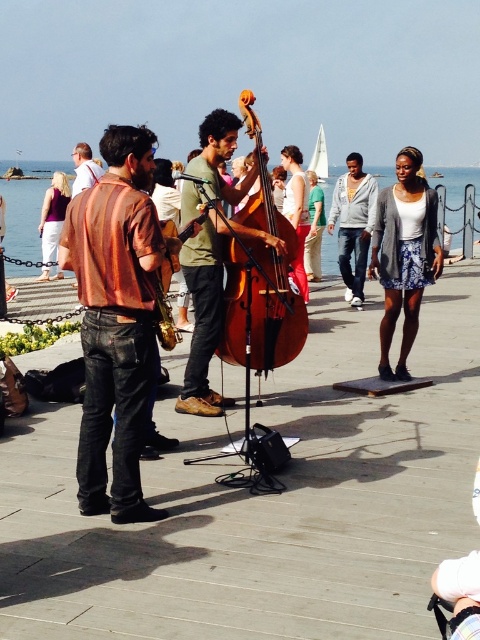
Consider the image. You are a photographer trying to capture the two musicians in the scene. You notice the green matte shirt at center and the matte brown leather jacket at center. Which clothing item appears narrower when viewed from your position?

The green matte shirt at center appears narrower compared to the matte brown leather jacket at center.

You are standing at the edge of the performance area and want to hand a drink to both musicians. The drink holder you have can only reach 4 meters. Can you reach both the matte orange shirt at center and the matte brown leather jacket at center with the drink holder?

The matte orange shirt at center is 4.64 meters away from the matte brown leather jacket at center. Since the drink holder can only reach 4 meters, you cannot reach both musicians simultaneously because the distance between them exceeds the reach of the drink holder.